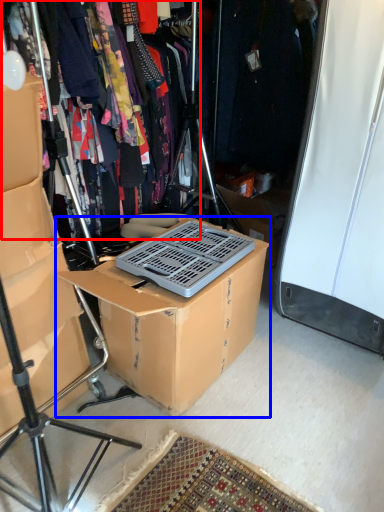
Question: Which point is closer to the camera, clothing (highlighted by a red box) or box (highlighted by a blue box)?

Choices:
 (A) clothing
 (B) box

Answer: (B)